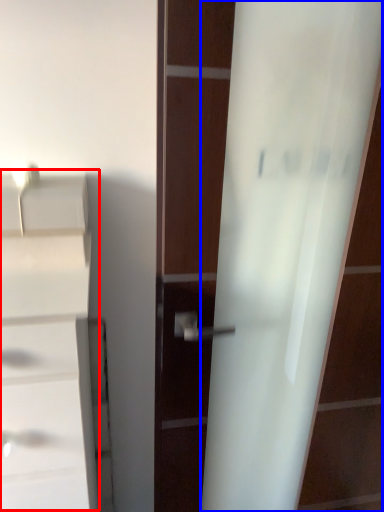
Question: Which of the following is the farthest to the observer, cabinetry (highlighted by a red box) or screen door (highlighted by a blue box)?

Choices:
 (A) cabinetry
 (B) screen door

Answer: (B)